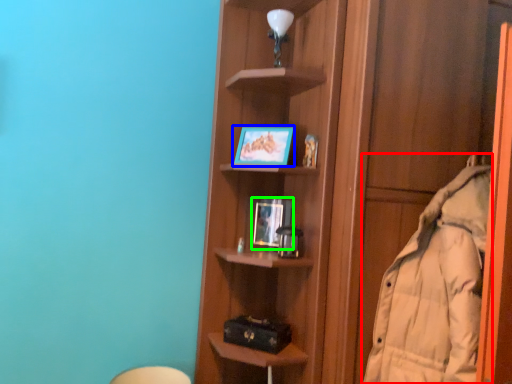
Question: Which is nearer to the coat (highlighted by a red box)? picture frame (highlighted by a blue box) or picture frame (highlighted by a green box).

Choices:
 (A) picture frame
 (B) picture frame

Answer: (B)